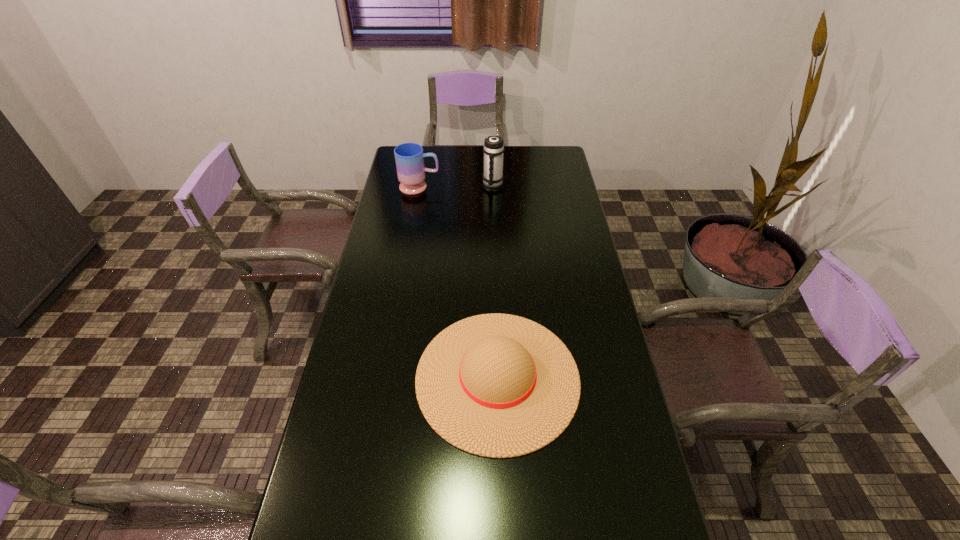
Where is `thermos bottle`? thermos bottle is located at coordinates (493, 149).

Where is `the second tallest object`? Image resolution: width=960 pixels, height=540 pixels. the second tallest object is located at coordinates pos(409,157).

At what (x,y) coordinates should I click in order to perform the action: click on bonnet. Please return your answer as a coordinate pair (x, y). The width and height of the screenshot is (960, 540). Looking at the image, I should click on (496, 385).

Find the location of a particular element. The width and height of the screenshot is (960, 540). the shortest object is located at coordinates (496, 385).

Where is `free space located 0.210m on the side with the handle of the thermos bottle`? Image resolution: width=960 pixels, height=540 pixels. free space located 0.210m on the side with the handle of the thermos bottle is located at coordinates coord(494,221).

Find the location of a particular element. This screenshot has height=540, width=960. vacant space situated on the side of the second tallest object with the handle is located at coordinates (526, 187).

Find the location of a particular element. This screenshot has width=960, height=540. vacant space located 0.320m on the back of the nearest object is located at coordinates (493, 248).

The height and width of the screenshot is (540, 960). In order to click on object at the left edge in this screenshot , I will do `click(409, 157)`.

This screenshot has height=540, width=960. I want to click on object present at the right edge, so click(496, 385).

The width and height of the screenshot is (960, 540). I want to click on free space at the far edge of the desktop, so click(463, 149).